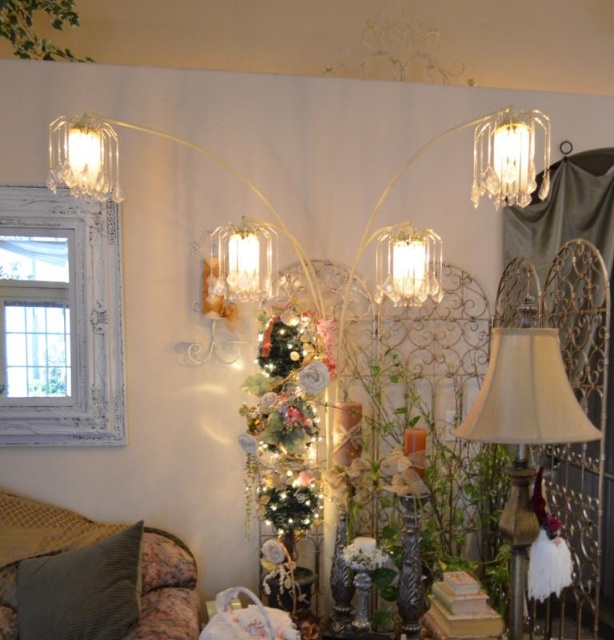
Does clear crystal chandelier at upper right have a lesser height compared to clear glass lampshade at upper left?

In fact, clear crystal chandelier at upper right may be taller than clear glass lampshade at upper left.

Can you confirm if clear crystal chandelier at upper right is taller than clear glass lampshade at upper left?

Correct, clear crystal chandelier at upper right is much taller as clear glass lampshade at upper left.

The image size is (614, 640). What do you see at coordinates (510, 157) in the screenshot? I see `clear crystal chandelier at upper right` at bounding box center [510, 157].

The image size is (614, 640). I want to click on clear crystal chandelier at upper right, so click(510, 157).

Does shiny metallic tree at center have a smaller size compared to clear glass lampshade at upper left?

Incorrect, shiny metallic tree at center is not smaller in size than clear glass lampshade at upper left.

Does shiny metallic tree at center lie in front of clear glass lampshade at upper left?

No, it is not.

Between point (321, 349) and point (106, 172), which one is positioned in front?

Point (106, 172)

What are the coordinates of `shiny metallic tree at center` in the screenshot? It's located at (287, 420).

In the scene shown: Is beige fabric lampshade at right shorter than clear crystal chandelier at upper right?

Incorrect, beige fabric lampshade at right's height does not fall short of clear crystal chandelier at upper right's.

This screenshot has width=614, height=640. Describe the element at coordinates (524, 429) in the screenshot. I see `beige fabric lampshade at right` at that location.

This screenshot has width=614, height=640. In order to click on beige fabric lampshade at right in this screenshot , I will do `click(524, 429)`.